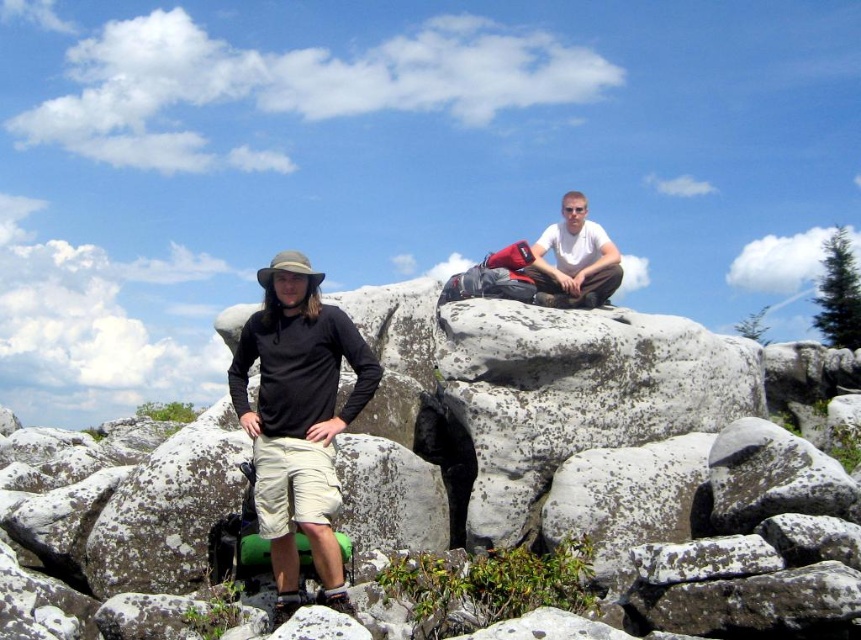
Question: Does black matte shirt at center appear over white matte shirt at upper center?

Choices:
 (A) yes
 (B) no

Answer: (B)

Question: Is black matte shirt at center below white matte shirt at upper center?

Choices:
 (A) no
 (B) yes

Answer: (B)

Question: Does black matte shirt at center have a greater width compared to white matte shirt at upper center?

Choices:
 (A) yes
 (B) no

Answer: (B)